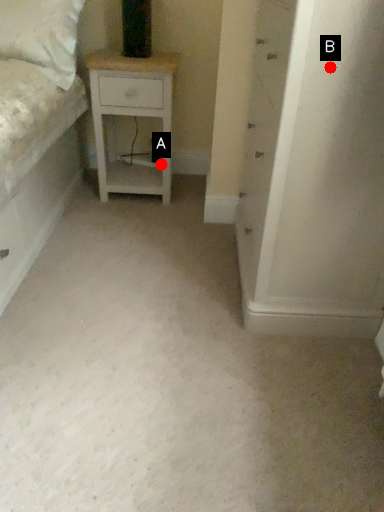
Question: Two points are circled on the image, labeled by A and B beside each circle. Among these points, which one is nearest to the camera?

Choices:
 (A) A is closer
 (B) B is closer

Answer: (B)